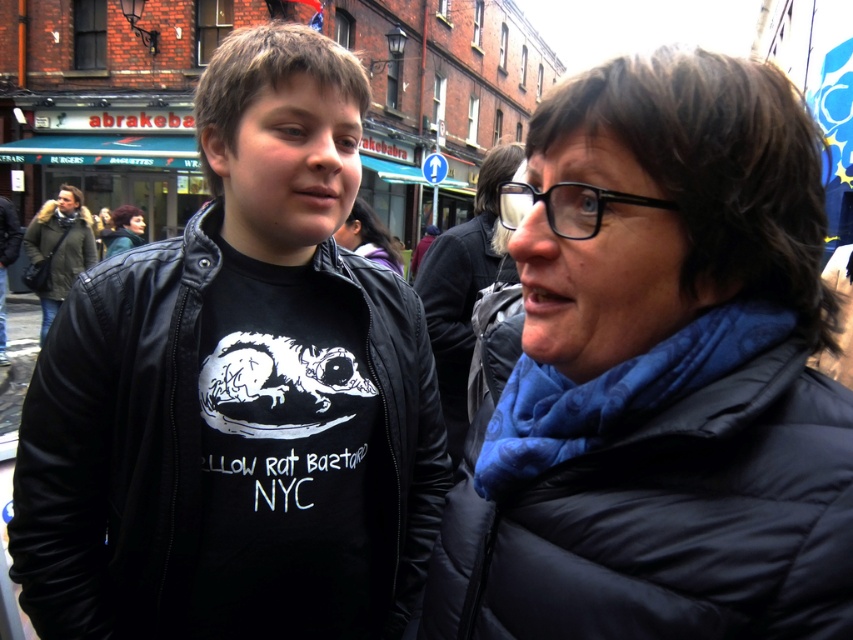
Question: Which object appears closest to the camera in this image?

Choices:
 (A) dark brown hair at center
 (B) green fuzzy coat at left

Answer: (B)

Question: Is matte black jacket at center thinner than black puffy jacket at right?

Choices:
 (A) yes
 (B) no

Answer: (B)

Question: Which is nearer to the black puffy jacket at right?

Choices:
 (A) green fuzzy coat at left
 (B) blue fleece scarf at upper right
 (C) matte black jacket at center
 (D) dark brown hair at center

Answer: (C)

Question: Is the position of matte black jacket at center more distant than that of green fuzzy coat at left?

Choices:
 (A) yes
 (B) no

Answer: (B)

Question: Which object is positioned farthest from the dark brown hair at center?

Choices:
 (A) black puffy jacket at right
 (B) blue fleece scarf at upper right
 (C) green fuzzy coat at left

Answer: (A)

Question: Does matte black jacket at center appear on the left side of green fuzzy coat at left?

Choices:
 (A) yes
 (B) no

Answer: (B)